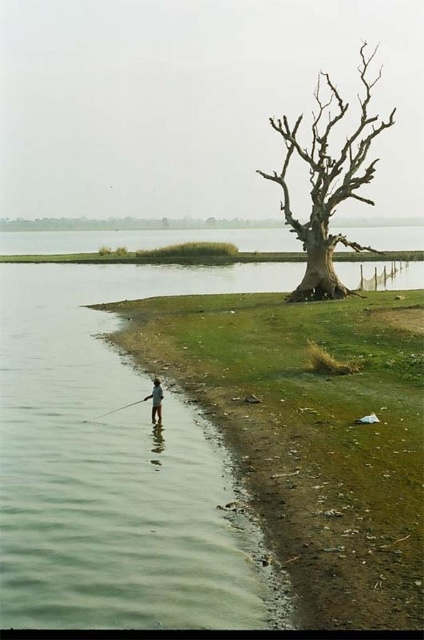
In the scene shown: Based on the coordinates provided, which part of the scene is located at point (310,435)?

The point (310,435) corresponds to the green grassy shoreline at lower left.